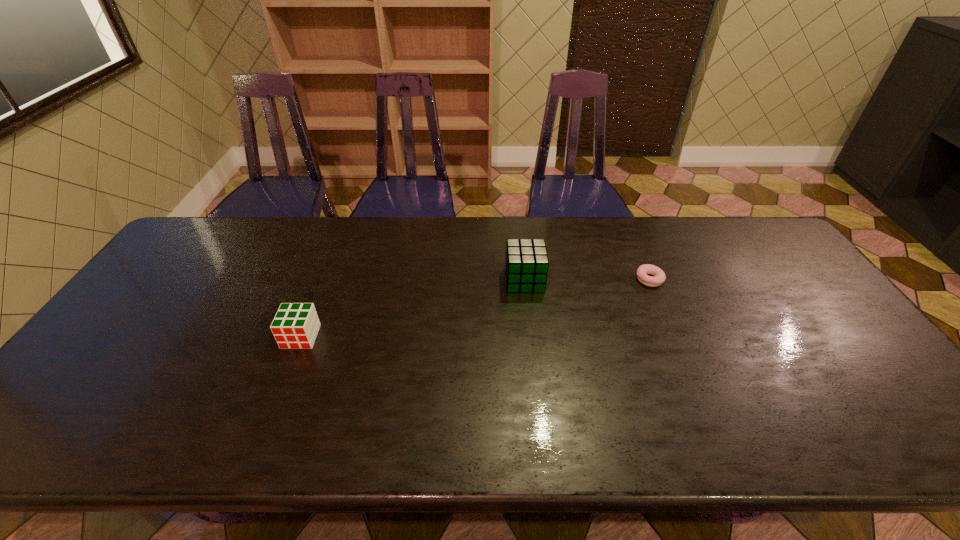
Locate an element on the screen. The width and height of the screenshot is (960, 540). the tallest object is located at coordinates (526, 266).

The width and height of the screenshot is (960, 540). Find the location of `the taller cube`. the taller cube is located at coordinates (526, 266).

Identify the location of the left cube. (295, 325).

Identify the location of the nearer cube. (295, 325).

Where is `doughnut`? The height and width of the screenshot is (540, 960). doughnut is located at coordinates (659, 277).

Identify the location of the rightmost object. (659, 277).

Locate an element on the screen. vacant space located 0.260m on the back of the taller cube is located at coordinates (518, 220).

Where is `free space located on the red face of the leftmost object`? This screenshot has width=960, height=540. free space located on the red face of the leftmost object is located at coordinates (277, 396).

What are the coordinates of `free space located 0.220m on the left of the doughnut` in the screenshot? It's located at (563, 279).

In the image, there is a desktop. Where is `free space at the far edge`? The height and width of the screenshot is (540, 960). free space at the far edge is located at coordinates (663, 251).